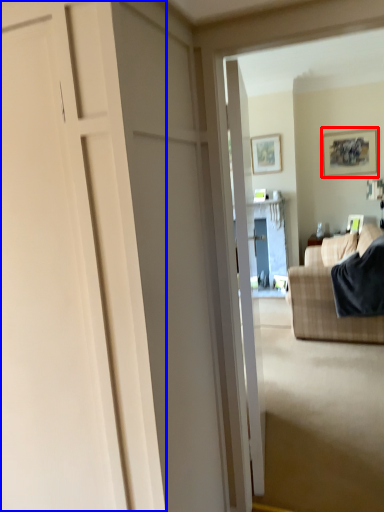
Question: Which object appears closest to the camera in this image, picture frame (highlighted by a red box) or door (highlighted by a blue box)?

Choices:
 (A) picture frame
 (B) door

Answer: (B)